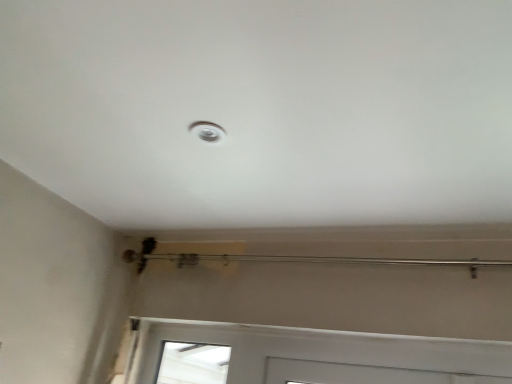
Question: Should I look upward or downward to see white glossy droplight at upper center?

Choices:
 (A) down
 (B) up

Answer: (B)